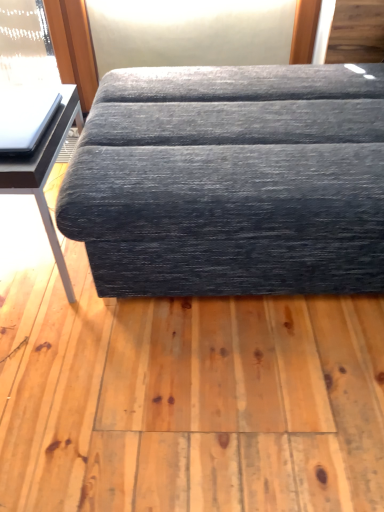
Describe the element at coordinates (231, 182) in the screenshot. The width and height of the screenshot is (384, 512). I see `textured gray fabric couch at center` at that location.

You are a GUI agent. You are given a task and a screenshot of the screen. Output one action in this format:
    pyautogui.click(x=<x>, y=<y>)
    Task: Click on the textured gray fabric couch at center
    
    Given the screenshot: What is the action you would take?
    pyautogui.click(x=231, y=182)

In order to face textured gray fabric couch at center, should I rotate leftwards or rightwards?

Rotate right and turn 11.409 degrees.

What is the approximate width of textured gray fabric couch at center?

It is 4.20 feet.

The image size is (384, 512). What do you see at coordinates (45, 170) in the screenshot? I see `matte black table at left` at bounding box center [45, 170].

Where is `matte black table at left`? The width and height of the screenshot is (384, 512). matte black table at left is located at coordinates (45, 170).

Find the location of `textured gray fabric couch at center`. textured gray fabric couch at center is located at coordinates pyautogui.click(x=231, y=182).

Considering the relative positions of matte black table at left and textured gray fabric couch at center in the image provided, is matte black table at left to the right of textured gray fabric couch at center from the viewer's perspective?

In fact, matte black table at left is to the left of textured gray fabric couch at center.

Is the depth of matte black table at left less than that of textured gray fabric couch at center?

No, it is behind textured gray fabric couch at center.

Is point (12, 157) behind point (163, 146)?

No, (12, 157) is closer to viewer.

Looking at this image, from the image's perspective, is matte black table at left above or below textured gray fabric couch at center?

matte black table at left is below textured gray fabric couch at center.

From a real-world perspective, is matte black table at left on textured gray fabric couch at center?

No, from a real-world perspective, matte black table at left is not over textured gray fabric couch at center

Can you confirm if matte black table at left is thinner than textured gray fabric couch at center?

Yes, matte black table at left is thinner than textured gray fabric couch at center.

Is matte black table at left taller than textured gray fabric couch at center?

No.

In the scene shown: Which of these two, matte black table at left or textured gray fabric couch at center, is smaller?

Smaller between the two is matte black table at left.

Would you say matte black table at left is inside or outside textured gray fabric couch at center?

matte black table at left is not enclosed by textured gray fabric couch at center.

Is matte black table at left touching textured gray fabric couch at center?

matte black table at left and textured gray fabric couch at center are not in contact.

Is matte black table at left oriented away from textured gray fabric couch at center?

No, matte black table at left's orientation is not away from textured gray fabric couch at center.

Can you tell me how much matte black table at left and textured gray fabric couch at center differ in facing direction?

The facing directions of matte black table at left and textured gray fabric couch at center are 90.3 degrees apart.

How far apart are matte black table at left and textured gray fabric couch at center?

matte black table at left and textured gray fabric couch at center are 19.65 inches apart from each other.

Find the location of `table below the textured gray fabric couch at center (from a real-world perspective)`. table below the textured gray fabric couch at center (from a real-world perspective) is located at coordinates (45, 170).

Consider the image. Between textured gray fabric couch at center and matte black table at left, which one appears on the right side from the viewer's perspective?

textured gray fabric couch at center.

In the image, is textured gray fabric couch at center positioned in front of or behind matte black table at left?

Clearly, textured gray fabric couch at center is in front of matte black table at left.

Is point (270, 188) closer or farther from the camera than point (44, 207)?

Point (270, 188).

From the image's perspective, is textured gray fabric couch at center positioned above or below matte black table at left?

textured gray fabric couch at center is above matte black table at left.

From a real-world perspective, is textured gray fabric couch at center physically below matte black table at left?

Actually, textured gray fabric couch at center is physically above matte black table at left in the real world.

From the picture: Is textured gray fabric couch at center wider or thinner than matte black table at left?

In the image, textured gray fabric couch at center appears to be wider than matte black table at left.

Can you confirm if textured gray fabric couch at center is taller than matte black table at left?

Yes, textured gray fabric couch at center is taller than matte black table at left.

Is textured gray fabric couch at center bigger than matte black table at left?

Correct, textured gray fabric couch at center is larger in size than matte black table at left.

Is textured gray fabric couch at center located outside matte black table at left?

Yes, textured gray fabric couch at center is located beyond the bounds of matte black table at left.

Is textured gray fabric couch at center far from matte black table at left?

textured gray fabric couch at center is near matte black table at left, not far away.

Is textured gray fabric couch at center positioned with its back to matte black table at left?

That's not correct — textured gray fabric couch at center is not looking away from matte black table at left.

This screenshot has width=384, height=512. I want to click on table below the textured gray fabric couch at center (from a real-world perspective), so click(x=45, y=170).

The height and width of the screenshot is (512, 384). Find the location of `studio couch in front of the matte black table at left`. studio couch in front of the matte black table at left is located at coordinates (231, 182).

What are the coordinates of `studio couch above the matte black table at left (from the image's perspective)` in the screenshot? It's located at (231, 182).